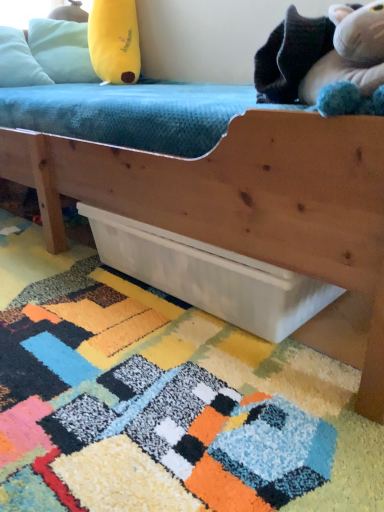
Question: Do you think yellow plush toy at upper left, the 1th toy viewed from the top, is within light blue fabric pillow at upper left, or outside of it?

Choices:
 (A) outside
 (B) inside

Answer: (A)

Question: Relative to light blue fabric pillow at upper left, is yellow plush toy at upper left, positioned as the 1th toy in back-to-front order, in front or behind?

Choices:
 (A) front
 (B) behind

Answer: (B)

Question: Which object is positioned farthest from the yellow plush toy at upper left, the second toy from the bottom?

Choices:
 (A) fluffy white stuffed animal at upper right, arranged as the first toy when viewed from the right
 (B) white matte drawer at lower center
 (C) light blue fabric pillow at upper left
 (D) multicolored shaggy rug at lower center

Answer: (A)

Question: Which object is positioned closest to the multicolored shaggy rug at lower center?

Choices:
 (A) white matte drawer at lower center
 (B) fluffy white stuffed animal at upper right, which appears as the 2th toy when viewed from the top
 (C) yellow plush toy at upper left, the first toy viewed from the left
 (D) light blue fabric pillow at upper left

Answer: (A)